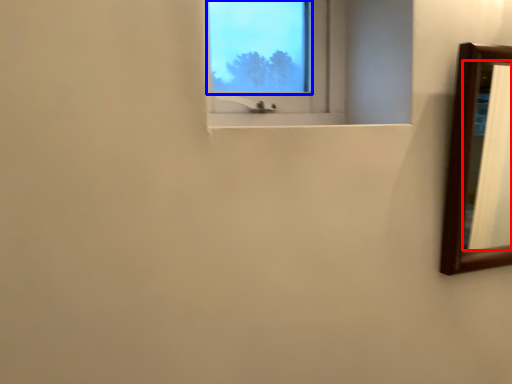
Question: Among these objects, which one is farthest to the camera, mirror (highlighted by a red box) or window screen (highlighted by a blue box)?

Choices:
 (A) mirror
 (B) window screen

Answer: (A)